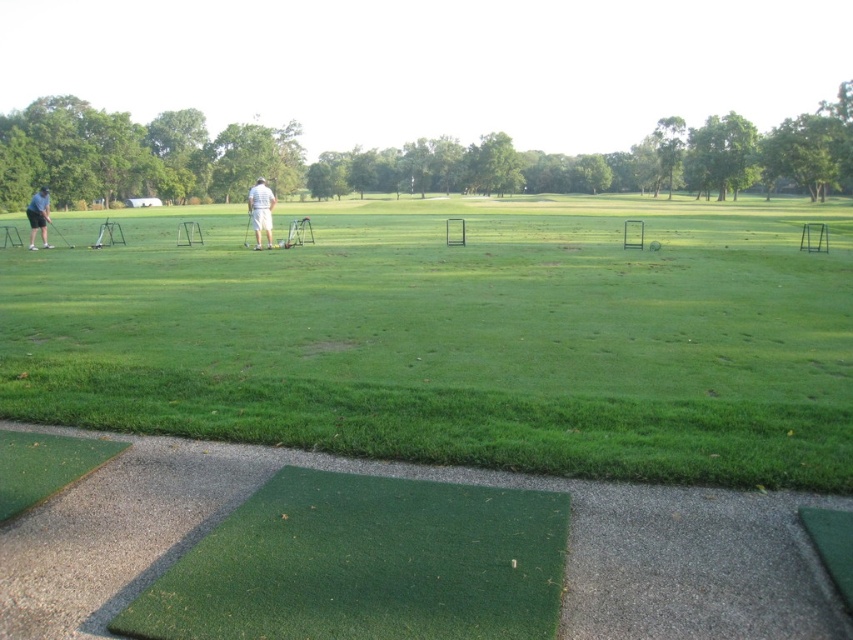
Question: Which point appears closest to the camera in this image?

Choices:
 (A) (44, 189)
 (B) (164, 273)

Answer: (B)

Question: Is white matte pants at center to the left of shiny silver golf club at left from the viewer's perspective?

Choices:
 (A) no
 (B) yes

Answer: (A)

Question: Which point is closer to the camera?

Choices:
 (A) white matte pants at center
 (B) light blue shirt at left

Answer: (A)

Question: Does white matte pants at center lie behind shiny silver golf club at left?

Choices:
 (A) yes
 (B) no

Answer: (B)

Question: Which object appears closest to the camera in this image?

Choices:
 (A) shiny silver golf club at left
 (B) white matte pants at center
 (C) light blue shirt at left
 (D) green grass at lower left

Answer: (D)

Question: Is green grass at lower left thinner than shiny silver golf club at left?

Choices:
 (A) yes
 (B) no

Answer: (B)